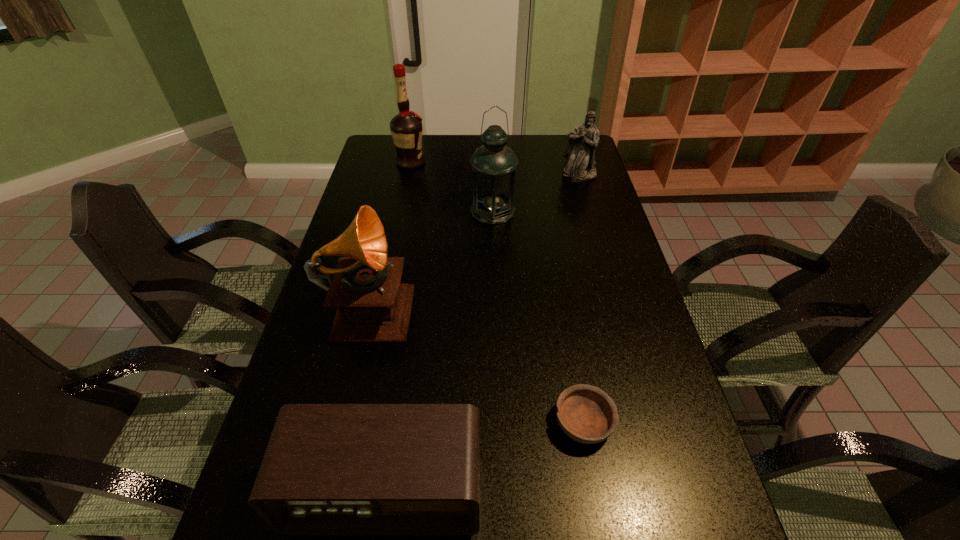
In order to click on blank region between the bowl and the rightmost object in this screenshot , I will do `click(581, 299)`.

Where is `free spot between the shortest object and the fourth tallest object`? This screenshot has height=540, width=960. free spot between the shortest object and the fourth tallest object is located at coordinates (581, 299).

This screenshot has height=540, width=960. I want to click on vacant region between the fourth nearest object and the liquor, so click(x=452, y=187).

The width and height of the screenshot is (960, 540). What are the coordinates of `object that is the fifth nearest to the phonograph record` in the screenshot? It's located at click(580, 165).

Locate an element on the screen. object that is the second closest one to the fifth tallest object is located at coordinates coord(373,307).

Identify the location of free region that satisfies the following two spatial constraints: 1. on the front and back of the liquor; 2. on the back side of the oil lamp. (400, 211).

Where is `vacant area that satisfies the following two spatial constraints: 1. on the front-facing side of the fourth tallest object; 2. on the horn of the third nearest object`? The image size is (960, 540). vacant area that satisfies the following two spatial constraints: 1. on the front-facing side of the fourth tallest object; 2. on the horn of the third nearest object is located at coordinates (616, 303).

Identify the location of free region that satisfies the following two spatial constraints: 1. on the front and back of the shortest object; 2. on the right side of the liquor. (355, 422).

Where is `free point that satisfies the following two spatial constraints: 1. on the front-facing side of the rightmost object; 2. on the horn of the phonograph record`? free point that satisfies the following two spatial constraints: 1. on the front-facing side of the rightmost object; 2. on the horn of the phonograph record is located at coordinates (616, 303).

The height and width of the screenshot is (540, 960). What are the coordinates of `free space that satisfies the following two spatial constraints: 1. on the front-facing side of the third shortest object; 2. on the horn of the phonograph record` in the screenshot? It's located at (616, 303).